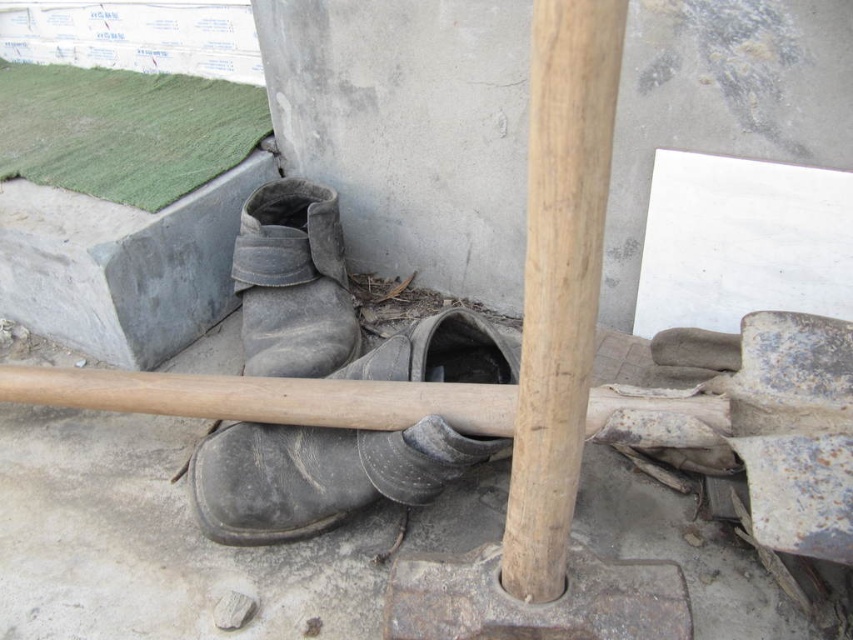
Question: Considering the relative positions of rusty metal shovel at center and smooth wood pole at center in the image provided, where is rusty metal shovel at center located with respect to smooth wood pole at center?

Choices:
 (A) right
 (B) left

Answer: (B)

Question: Which of the following is the farthest from the observer?

Choices:
 (A) (192, 461)
 (B) (592, 220)
 (C) (381, 378)
 (D) (625, 406)

Answer: (A)

Question: Which is nearer to the rusty metal shovel at center?

Choices:
 (A) smooth wood pole at center
 (B) leather boot at center
 (C) worn leather boot at center

Answer: (C)

Question: Does leather boot at center appear on the right side of worn leather boot at center?

Choices:
 (A) yes
 (B) no

Answer: (B)

Question: Among these points, which one is nearest to the camera?

Choices:
 (A) (368, 458)
 (B) (616, 422)
 (C) (579, 298)
 (D) (332, 298)

Answer: (C)

Question: Is smooth wood pole at center above leather boot at center?

Choices:
 (A) yes
 (B) no

Answer: (A)